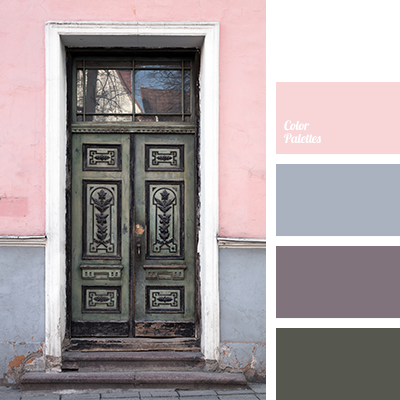
Where is `top rail`? The image size is (400, 400). top rail is located at coordinates (124, 130).